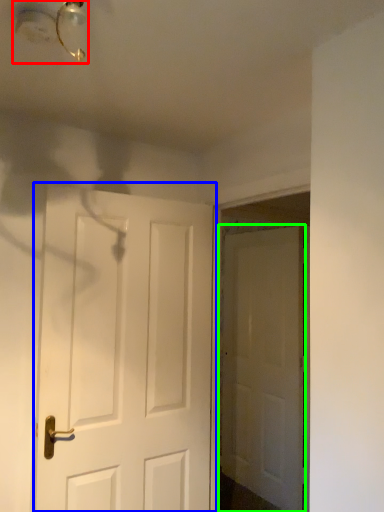
Question: Estimate the real-world distances between objects in this image. Which object is closer to light fixture (highlighted by a red box), door (highlighted by a blue box) or door (highlighted by a green box)?

Choices:
 (A) door
 (B) door

Answer: (A)